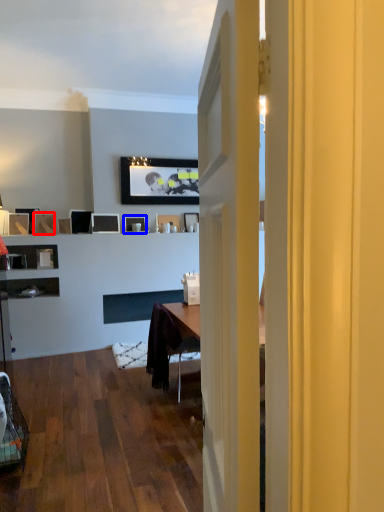
Question: Which of the following is the farthest to the observer, picture frame (highlighted by a red box) or picture frame (highlighted by a blue box)?

Choices:
 (A) picture frame
 (B) picture frame

Answer: (B)